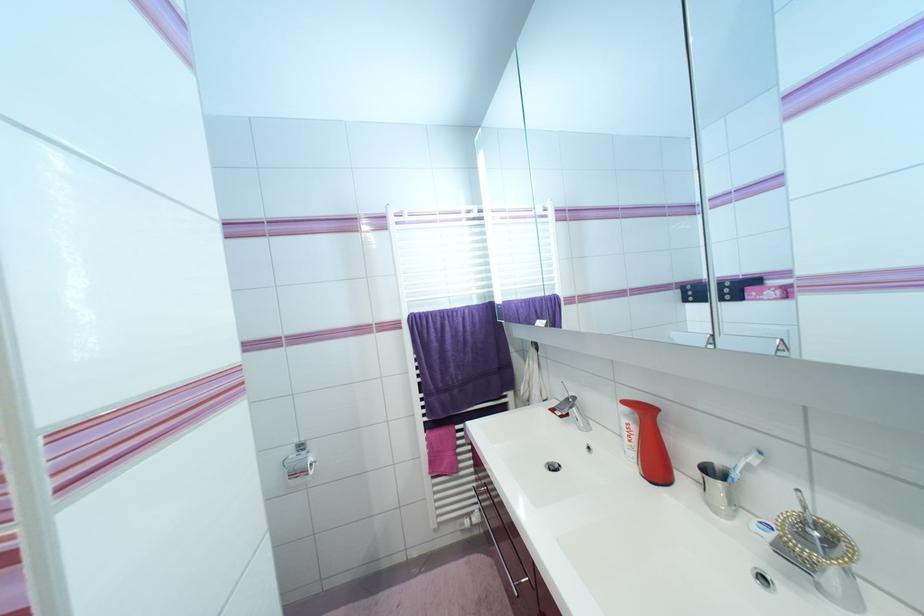
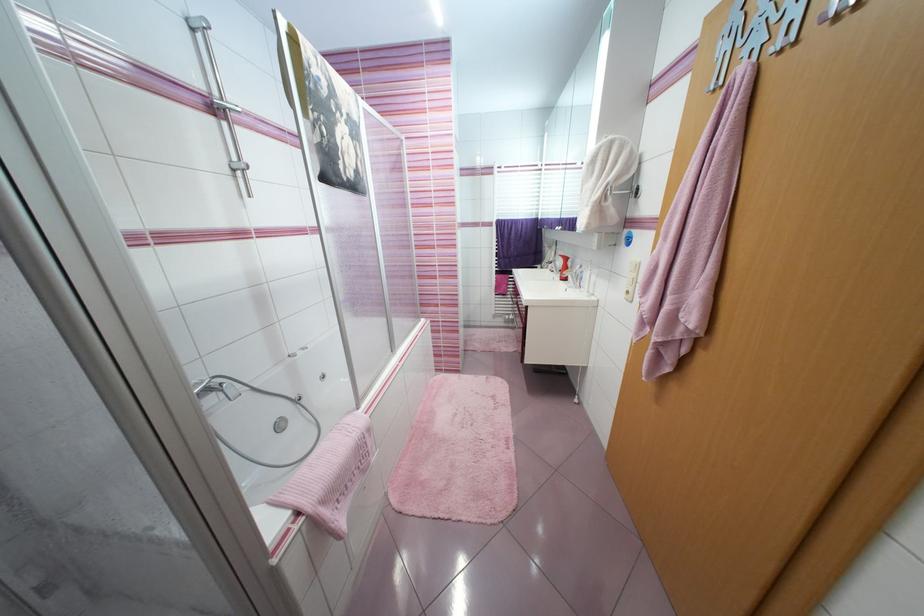
The point at (495, 288) is marked in the first image. Where is the corresponding point in the second image?

(543, 211)